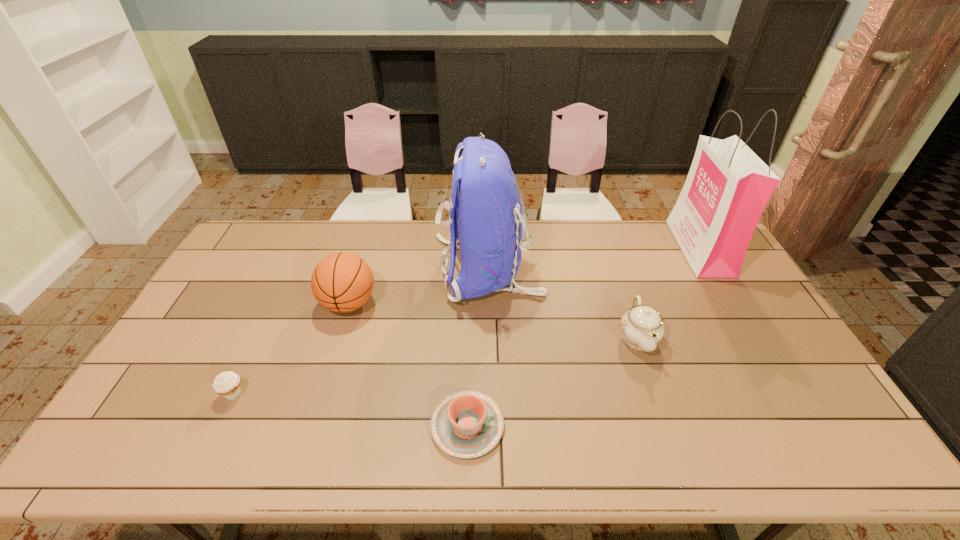
Where is `object that ranks as the closest to the rightmost object`? object that ranks as the closest to the rightmost object is located at coordinates (642, 327).

What are the coordinates of `vacant space that satisfies the following two spatial constraints: 1. on the front-facing side of the shopping bag; 2. at the spout of the fifth object from left to right` in the screenshot? It's located at (753, 338).